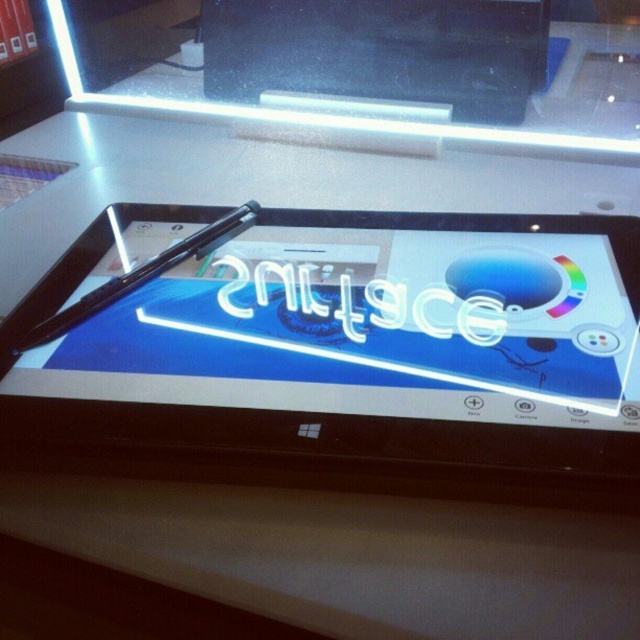
Question: Is matte black tablet at center in front of matte black laptop at upper center?

Choices:
 (A) yes
 (B) no

Answer: (A)

Question: Which point appears farthest from the camera in this image?

Choices:
 (A) (403, 72)
 (B) (234, 224)
 (C) (636, 355)

Answer: (A)

Question: Can you confirm if matte black laptop at upper center is positioned to the left of black glossy pen at center?

Choices:
 (A) yes
 (B) no

Answer: (B)

Question: Which point appears closest to the camera in this image?

Choices:
 (A) (280, 28)
 (B) (68, 321)
 (C) (604, 224)

Answer: (B)

Question: From the image, what is the correct spatial relationship of matte black tablet at center in relation to black glossy pen at center?

Choices:
 (A) below
 (B) above

Answer: (A)

Question: Based on their relative distances, which object is nearer to the matte black laptop at upper center?

Choices:
 (A) matte black tablet at center
 (B) black glossy pen at center

Answer: (B)